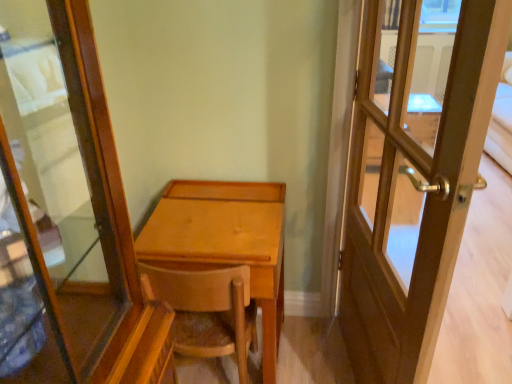
This screenshot has height=384, width=512. Identify the location of blank space situated above light brown wood desk at center (from a real-world perspective). (221, 202).